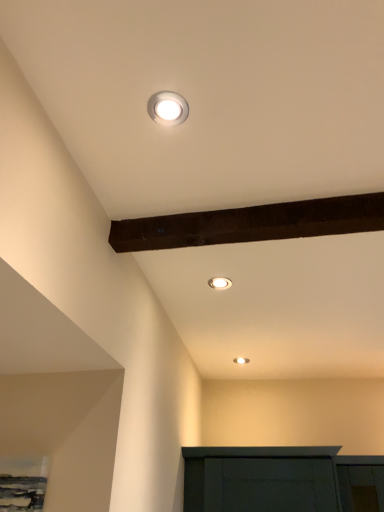
Question: Which direction should I rotate to face white glossy light fixture at upper center, marked as the third lamp in a back-to-front arrangement, — up or down?

Choices:
 (A) down
 (B) up

Answer: (B)

Question: Is white glossy light fixture at upper center, the 3th lamp from the front, further to the viewer compared to white glossy light fixture at upper center, the 3th lamp positioned from the right?

Choices:
 (A) yes
 (B) no

Answer: (A)

Question: Can you confirm if white glossy light fixture at upper center, which is the 3th lamp in left-to-right order, is thinner than white glossy light fixture at upper center, which is the first lamp in top-to-bottom order?

Choices:
 (A) no
 (B) yes

Answer: (B)

Question: Is white glossy light fixture at upper center, which appears as the 1th lamp when ordered from the bottom, outside white glossy light fixture at upper center, the 3th lamp positioned from the right?

Choices:
 (A) yes
 (B) no

Answer: (A)

Question: Is white glossy light fixture at upper center, the 3th lamp from the front, wider than white glossy light fixture at upper center, acting as the first lamp starting from the left?

Choices:
 (A) yes
 (B) no

Answer: (B)

Question: Is white glossy light fixture at upper center, the 1th lamp positioned from the right, closer to the viewer compared to white glossy light fixture at upper center, arranged as the first lamp when viewed from the front?

Choices:
 (A) yes
 (B) no

Answer: (B)

Question: Could white glossy light fixture at upper center, acting as the first lamp starting from the left, be considered to be inside white glossy light fixture at upper center, which is the 3th lamp in left-to-right order?

Choices:
 (A) yes
 (B) no

Answer: (B)

Question: Is white glossy light fixture at upper center, which is the first lamp in top-to-bottom order, closer to camera compared to matte white recessed light at center, placed as the second lamp when sorted from front to back?

Choices:
 (A) yes
 (B) no

Answer: (A)

Question: From the image's perspective, is white glossy light fixture at upper center, which is the first lamp in top-to-bottom order, on top of matte white recessed light at center, the second lamp viewed from the left?

Choices:
 (A) no
 (B) yes

Answer: (B)

Question: Is white glossy light fixture at upper center, acting as the first lamp starting from the left, directly adjacent to matte white recessed light at center, the second lamp viewed from the left?

Choices:
 (A) no
 (B) yes

Answer: (A)

Question: Is matte white recessed light at center, placed as the second lamp when sorted from front to back, completely or partially inside white glossy light fixture at upper center, the 3th lamp positioned from the right?

Choices:
 (A) yes
 (B) no

Answer: (B)

Question: From a real-world perspective, is white glossy light fixture at upper center, acting as the first lamp starting from the left, positioned over matte white recessed light at center, the second lamp viewed from the left, based on gravity?

Choices:
 (A) yes
 (B) no

Answer: (B)

Question: Does white glossy light fixture at upper center, the 3th lamp positioned from the right, appear on the right side of matte white recessed light at center, placed as the second lamp when sorted from front to back?

Choices:
 (A) no
 (B) yes

Answer: (A)

Question: Is matte white recessed light at center, which is the second lamp from back to front, at the left side of white glossy light fixture at upper center, the 3th lamp from the front?

Choices:
 (A) no
 (B) yes

Answer: (B)